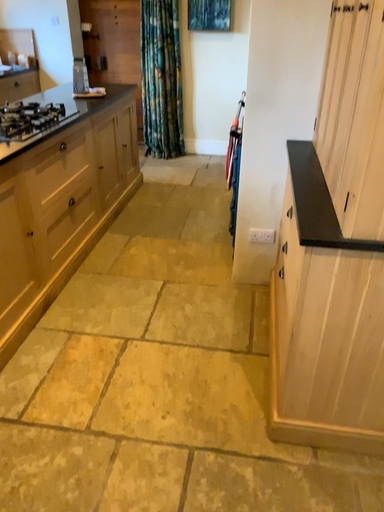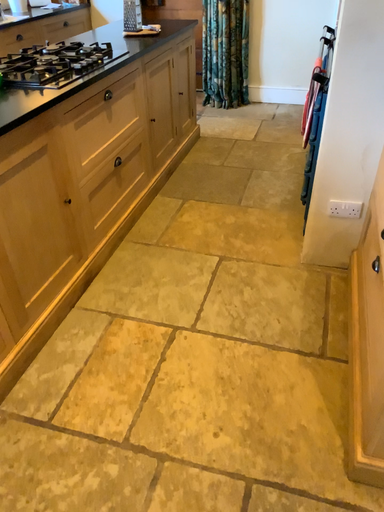
Question: How did the camera likely rotate when shooting the video?

Choices:
 (A) rotated right
 (B) rotated left

Answer: (B)